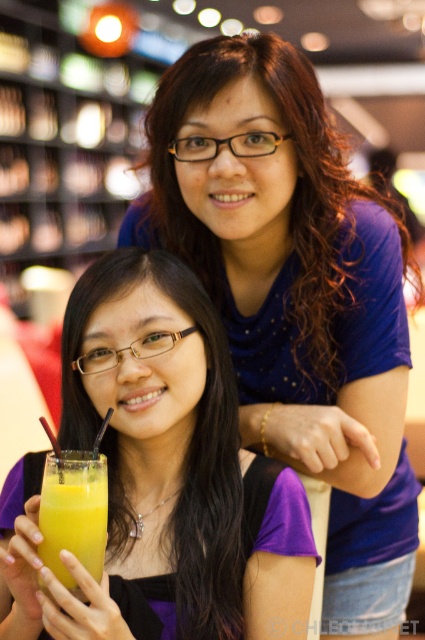
From the picture: You are a photographer trying to capture a closeup of the orange juice at lower left without the purple matte shirt at center overlapping. Given their sizes, is this feasible?

The purple matte shirt at center is wider than the orange juice at lower left. Since the shirt is wider, it might still block the view of the orange juice even if positioned to the side, making it challenging to avoid overlap without moving the shirt or the juice.

You are a photographer trying to capture a closeup of the orange juice at lower left without the purple matte shirt at center overlapping. Can you adjust your camera angle to achieve this?

The purple matte shirt at center is bigger than orange juice at lower left, so adjusting the camera angle to focus on the orange juice at lower left while avoiding the larger purple matte shirt at center might be possible by moving the camera position slightly to the side or tilting it downward.

You are a photographer adjusting the focus of your camera. The camera currently focuses on the point at coordinates point (294, 298). According to the scene description, what object is the camera focused on?

The camera is focused on the matte blue shirt at upper center marked by point (294, 298).